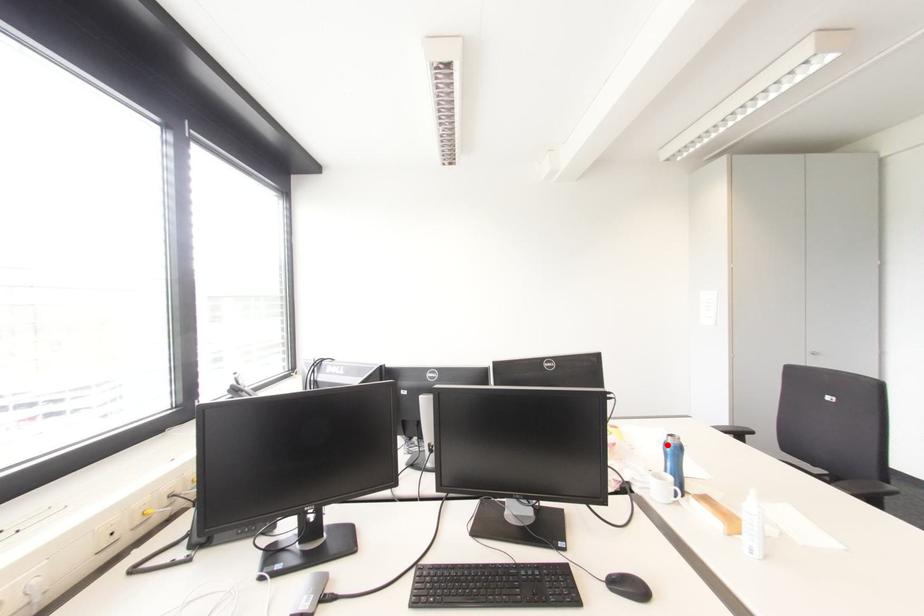
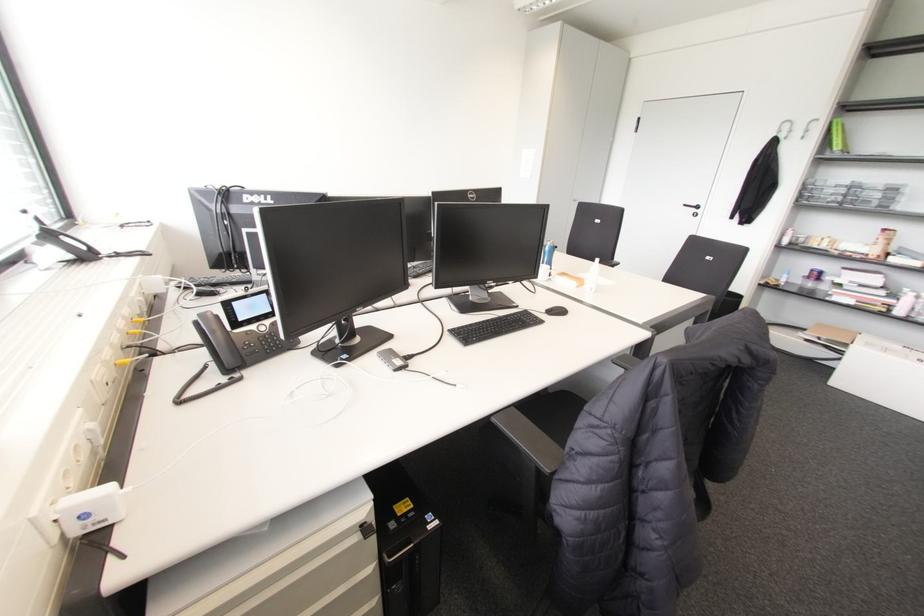
Locate, in the second image, the point that corresponds to the highlighted location in the first image.

(546, 246)